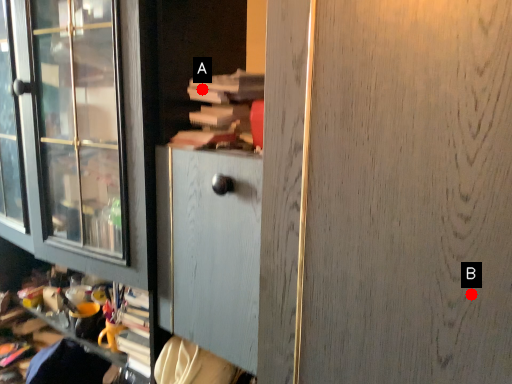
Question: Two points are circled on the image, labeled by A and B beside each circle. Which point is closer to the camera taking this photo?

Choices:
 (A) A is closer
 (B) B is closer

Answer: (B)